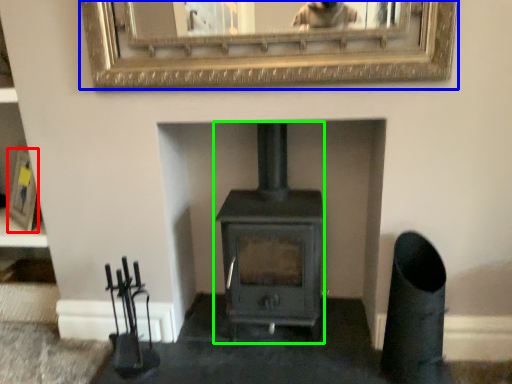
Question: Considering the real-world distances, which object is closest to picture frame (highlighted by a red box)? picture frame (highlighted by a blue box) or wood burning stove (highlighted by a green box).

Choices:
 (A) picture frame
 (B) wood burning stove

Answer: (B)